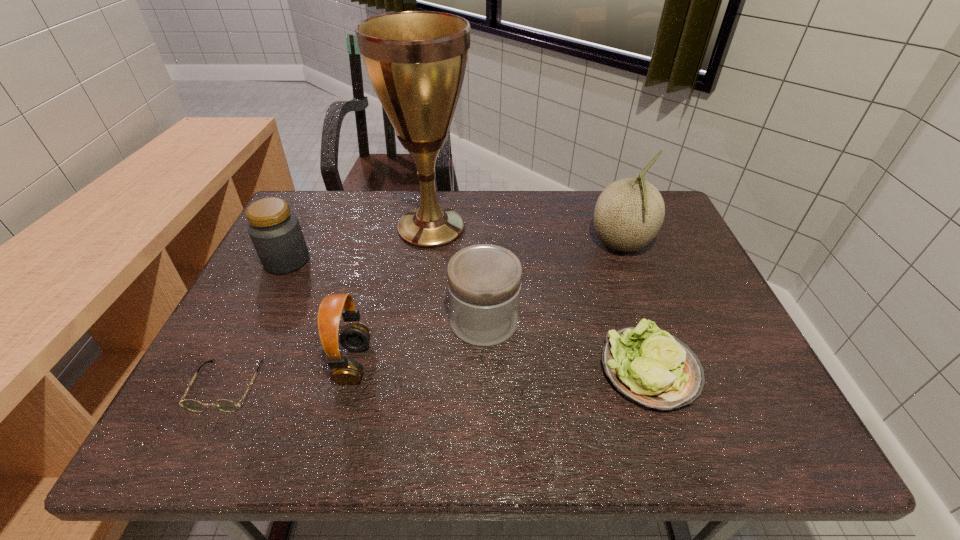
Locate an element on the screen. This screenshot has height=540, width=960. vacant space at the near left corner of the desktop is located at coordinates (247, 451).

You are a GUI agent. You are given a task and a screenshot of the screen. Output one action in this format:
    pyautogui.click(x=<x>, y=<y>)
    Task: Click on the free space that is in between the sixth tallest object and the trophy cup
    
    Given the screenshot: What is the action you would take?
    coord(540,299)

Where is `empty space between the left jar and the trophy cup`? The height and width of the screenshot is (540, 960). empty space between the left jar and the trophy cup is located at coordinates (359, 244).

Where is `empty location between the shortest object and the second tallest object`? This screenshot has width=960, height=540. empty location between the shortest object and the second tallest object is located at coordinates (424, 315).

Image resolution: width=960 pixels, height=540 pixels. In order to click on free space between the farther jar and the spectacles in this screenshot , I will do `click(257, 323)`.

In order to click on object that stands as the fifth closest to the second shortest object in this screenshot , I will do `click(225, 405)`.

The image size is (960, 540). I want to click on object that is the sixth closest to the farther jar, so click(629, 213).

The height and width of the screenshot is (540, 960). Find the location of `free space that satisfies the following two spatial constraints: 1. on the surface of the left jar near the warning symbol; 2. on the left side of the lettuce`. free space that satisfies the following two spatial constraints: 1. on the surface of the left jar near the warning symbol; 2. on the left side of the lettuce is located at coordinates point(233,370).

Where is `free spot that satisfies the following two spatial constraints: 1. on the ear cups of the headset; 2. on the lenses of the spectacles`? This screenshot has height=540, width=960. free spot that satisfies the following two spatial constraints: 1. on the ear cups of the headset; 2. on the lenses of the spectacles is located at coordinates 348,385.

Find the location of `blank area in the image that satisfies the following two spatial constraints: 1. on the back side of the lettuce; 2. on the right side of the cantaloup`. blank area in the image that satisfies the following two spatial constraints: 1. on the back side of the lettuce; 2. on the right side of the cantaloup is located at coordinates (608, 245).